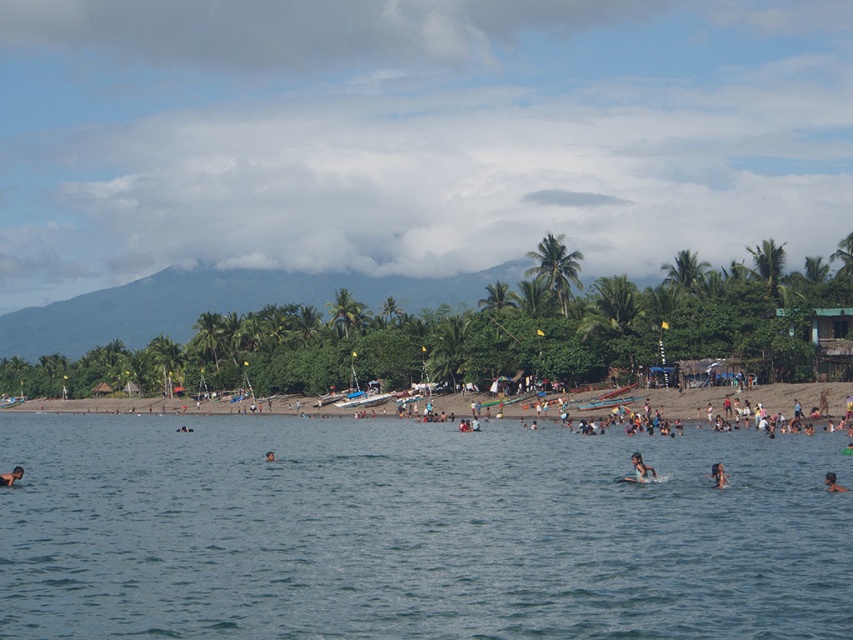
You are a photographer trying to capture a clear shot of both the brown textured surfboard at center and the brown hair at center. Since you want to focus on the larger object first, which one should you adjust your camera settings for?

The brown textured surfboard at center is bigger than the brown hair at center, so you should adjust your camera settings for the brown textured surfboard at center first.

You are a swimmer looking to enter the water. You see the blue water at center and the brown hair at center. Which one is located below the other?

The blue water at center is positioned under brown hair at center, so the water is below the hair.

You are a photographer at the beach and want to capture both the dark brown skin at lower left and the smooth skin head at lower right in the same frame. Which subject should you focus on first to ensure both are in the frame?

The dark brown skin at lower left is larger in size than the smooth skin head at lower right, so you should focus on the dark brown skin at lower left first to ensure both fit within the frame.